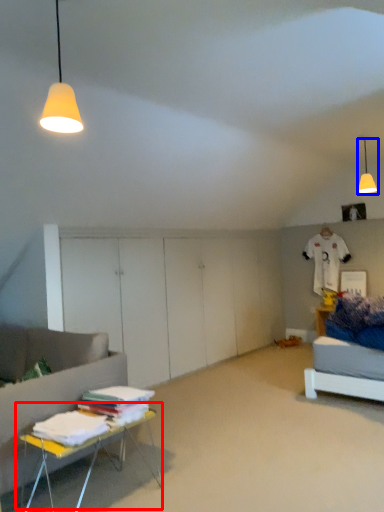
Question: Which object appears farthest to the camera in this image, table (highlighted by a red box) or lamp (highlighted by a blue box)?

Choices:
 (A) table
 (B) lamp

Answer: (B)